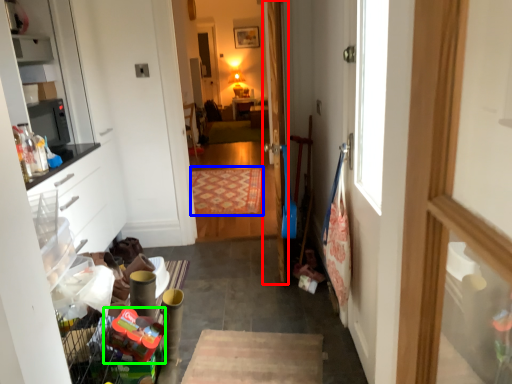
Question: Which object is the farthest from door (highlighted by a red box)? Choose among these: mat (highlighted by a blue box) or toy (highlighted by a green box).

Choices:
 (A) mat
 (B) toy

Answer: (A)